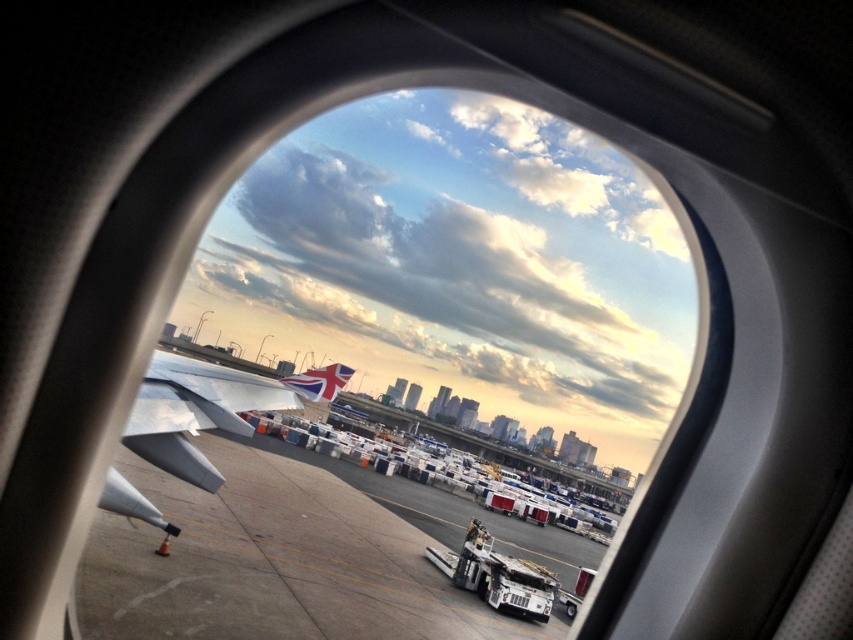
You are a flight attendant who needs to check the distance between the concrete tarmac at center and the silver metallic wing at lower left. Which object is higher in the image?

The concrete tarmac at center is much taller than the silver metallic wing at lower left, so the concrete tarmac at center is higher in the image.

You are a passenger sitting in the airplane and looking out the window. You see the concrete tarmac at center and the silver metallic wing at lower left. Which object is closer to you?

The concrete tarmac at center is closer to you because it is further to the viewer than the silver metallic wing at lower left.